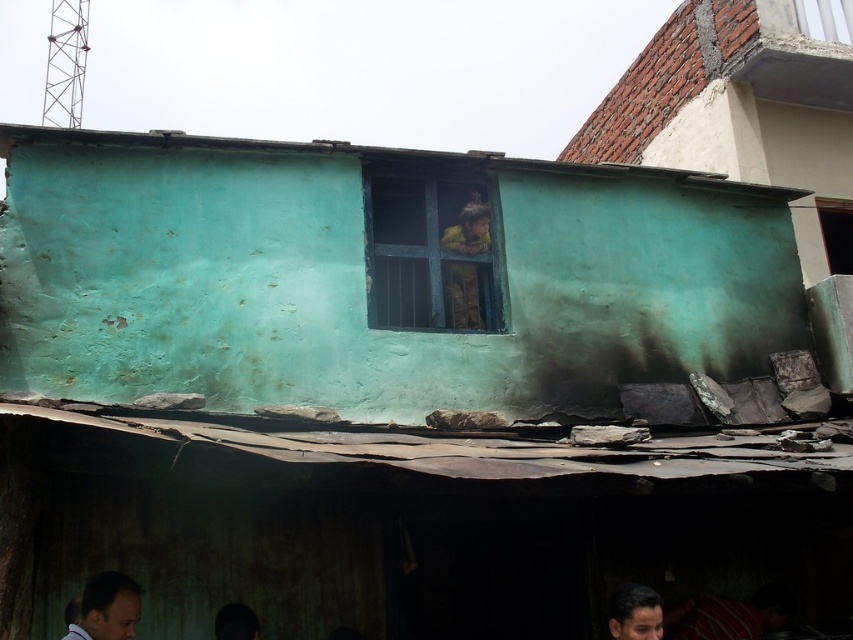
You are a photographer trying to capture a closeup of the two people with dark brown hair at lower left and smooth brown hair at lower right. Which person has hair that is thinner?

The dark brown hair at lower left is thinner than the smooth brown hair at lower right, so the person with dark brown hair at lower left has thinner hair.

You are a photographer trying to capture a portrait of the two people with dark brown hair at lower left and smooth brown hair at lower right. Which person should you focus on to ensure their full head is visible in the frame?

You should focus on the dark brown hair at lower left because it has a greater height compared to the smooth brown hair at lower right, so it will be fully visible in the frame.

You are standing in front of a weathered building with a teal facade. You notice two points marked on the roof. The first point is at coordinate (x=674, y=13) and the second at (x=91, y=632). Which of these points is closer to you?

Point (x=674, y=13) is further to the viewer than point (x=91, y=632), so the point at (x=91, y=632) is closer to you.